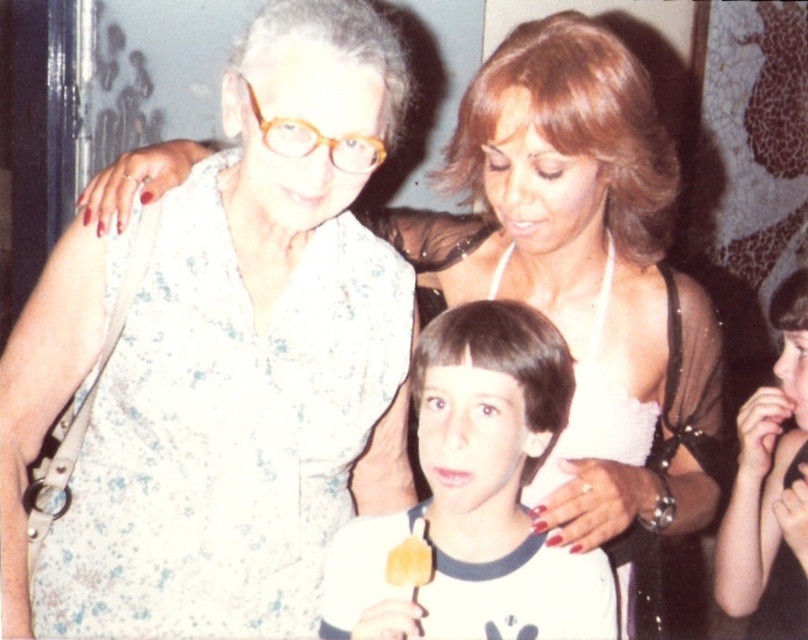
Does point (250, 557) lie behind point (537, 420)?

That is True.

Does floral fabric blouse at center appear under smooth white shirt at center?

No, floral fabric blouse at center is not below smooth white shirt at center.

Which is in front, point (95, 253) or point (415, 627)?

Point (415, 627) is in front.

You are a GUI agent. You are given a task and a screenshot of the screen. Output one action in this format:
    pyautogui.click(x=<x>, y=<y>)
    Task: Click on the floral fabric blouse at center
    
    Given the screenshot: What is the action you would take?
    pyautogui.click(x=225, y=362)

Is point (394, 289) positioned behind point (794, 317)?

That is False.

At what (x,y) coordinates should I click in order to perform the action: click on floral fabric blouse at center. Please return your answer as a coordinate pair (x, y). The image size is (808, 640). Looking at the image, I should click on (225, 362).

Which is behind, point (285, 326) or point (806, 289)?

The point (806, 289) is more distant.

Find the location of a particular element. This screenshot has height=640, width=808. floral fabric blouse at center is located at coordinates (225, 362).

Does point (423, 636) come closer to viewer compared to point (415, 534)?

No, (423, 636) is further to viewer.

Which of these two, smooth white shirt at center or yellow matte cookie at center, stands shorter?

With less height is yellow matte cookie at center.

Is point (598, 570) positioned after point (413, 582)?

Yes, point (598, 570) is farther from viewer.

Identify the location of smooth white shirt at center. This screenshot has height=640, width=808. (474, 497).